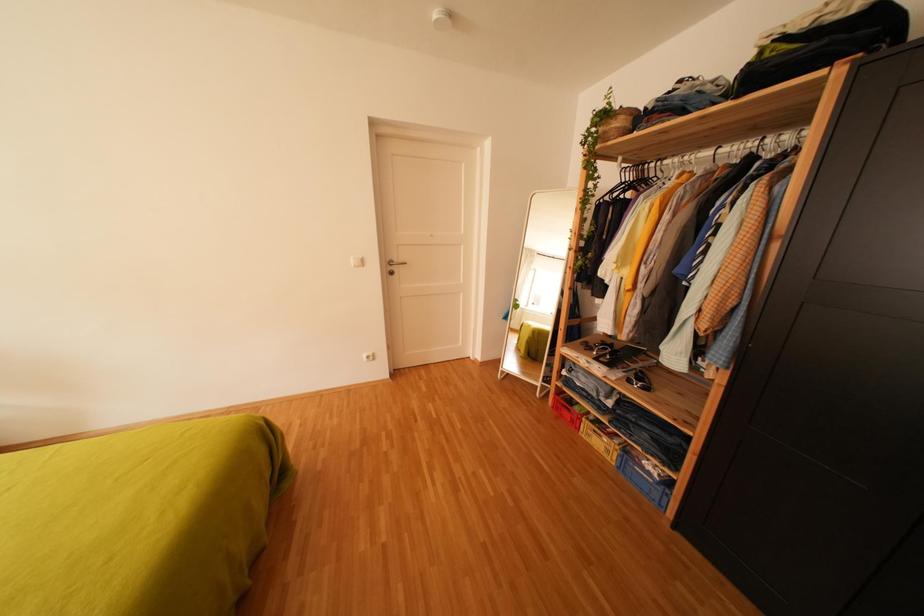
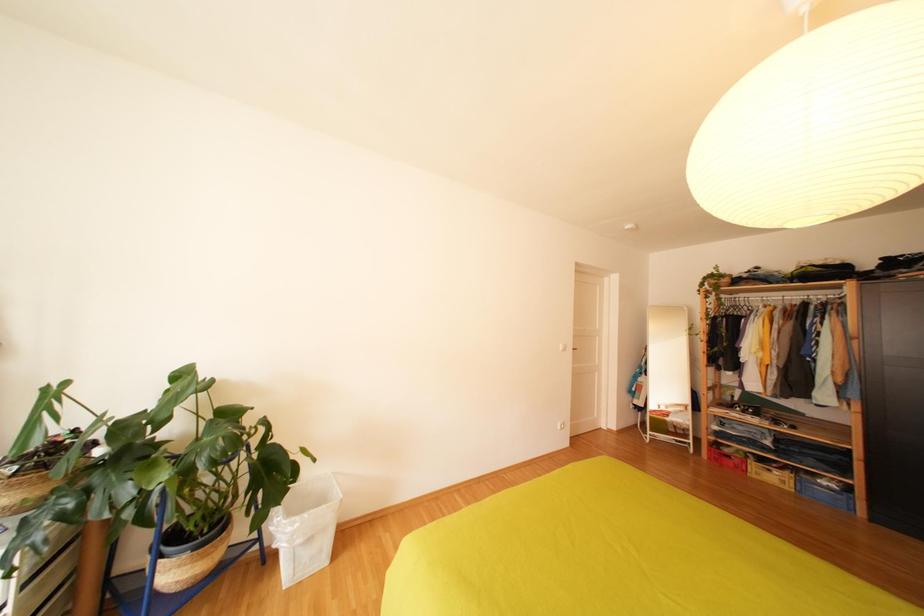
Question: The images are taken continuously from a first-person perspective. In which direction are you moving?

Choices:
 (A) Left
 (B) Right
 (C) Forward
 (D) Backward

Answer: (A)